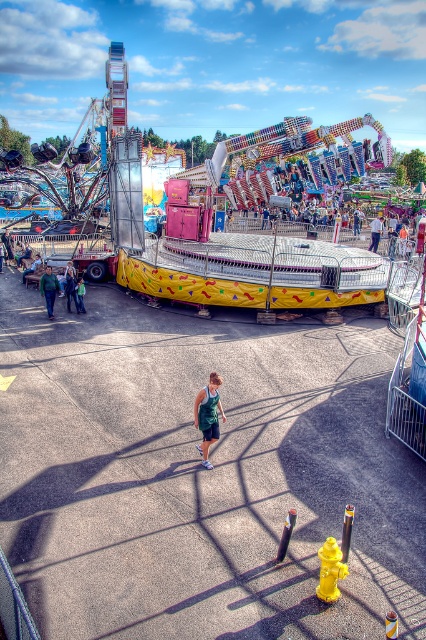
How far apart are green fabric jacket at lower left and green fabric dress at center?

green fabric jacket at lower left is 61.10 feet from green fabric dress at center.

Between green fabric jacket at lower left and green fabric dress at center, which one is positioned higher?

green fabric dress at center

Image resolution: width=426 pixels, height=640 pixels. Describe the element at coordinates (48, 289) in the screenshot. I see `green fabric jacket at lower left` at that location.

Find the location of a particular element. green fabric jacket at lower left is located at coordinates (48, 289).

The height and width of the screenshot is (640, 426). What do you see at coordinates (207, 416) in the screenshot? I see `green fabric shorts at center` at bounding box center [207, 416].

Who is positioned more to the left, green fabric shorts at center or green fabric jacket at lower left?

green fabric jacket at lower left is more to the left.

This screenshot has width=426, height=640. I want to click on green fabric shorts at center, so click(x=207, y=416).

Locate an element on the screen. green fabric shorts at center is located at coordinates (207, 416).

Describe the element at coordinates (207, 416) in the screenshot. The height and width of the screenshot is (640, 426). I see `green fabric shorts at center` at that location.

Where is `green fabric shorts at center`? This screenshot has height=640, width=426. green fabric shorts at center is located at coordinates (207, 416).

The width and height of the screenshot is (426, 640). I want to click on green fabric shorts at center, so click(x=207, y=416).